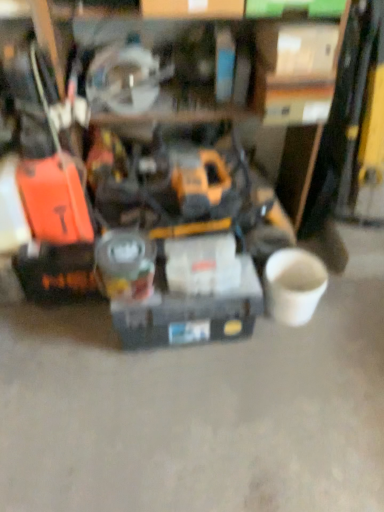
Question: Looking at their shapes, would you say yellow/black plastic drill at center is wider or thinner than white cardboard box at upper center, which is the first box in right-to-left order?

Choices:
 (A) thin
 (B) wide

Answer: (B)

Question: From the image's perspective, relative to white cardboard box at upper center, the first box from the top, is yellow/black plastic drill at center above or below?

Choices:
 (A) above
 (B) below

Answer: (B)

Question: Based on their relative distances, which object is nearer to the white cardboard box at upper center, the first box from the top?

Choices:
 (A) yellow/black plastic drill at center
 (B) matte gray toolbox at center, which is the second box in top-to-bottom order

Answer: (A)

Question: Considering the real-world distances, which object is farthest from the white cardboard box at upper center, which ranks as the second box in left-to-right order?

Choices:
 (A) yellow/black plastic drill at center
 (B) matte gray toolbox at center, the 2th box in the right-to-left sequence

Answer: (B)